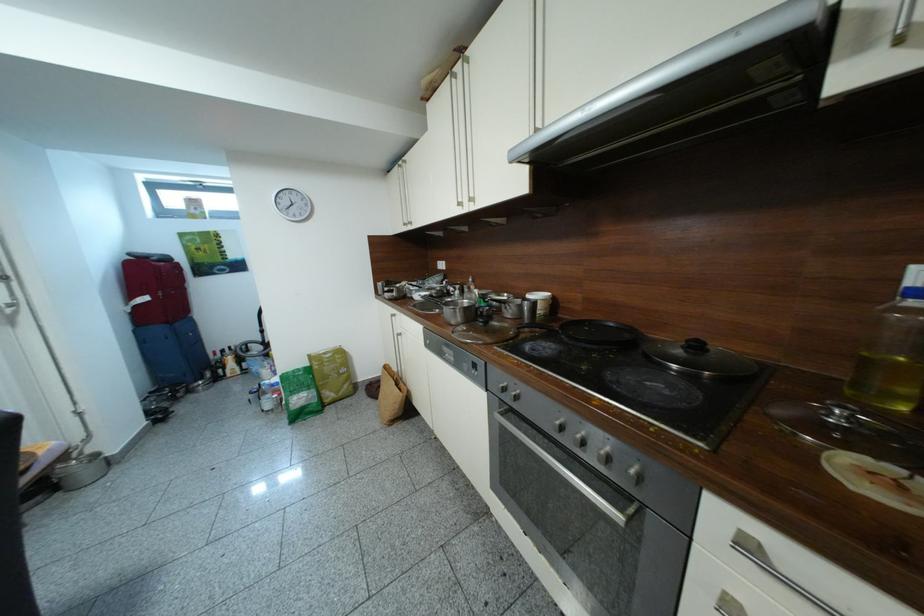
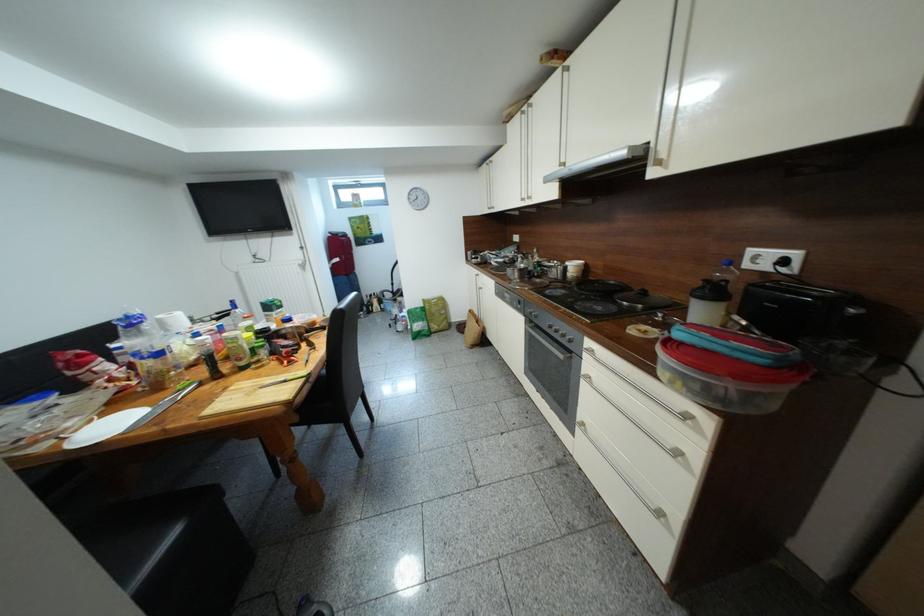
Question: In a continuous first-person perspective shot, in which direction is the camera moving?

Choices:
 (A) Left
 (B) Right
 (C) Forward
 (D) Backward

Answer: (D)